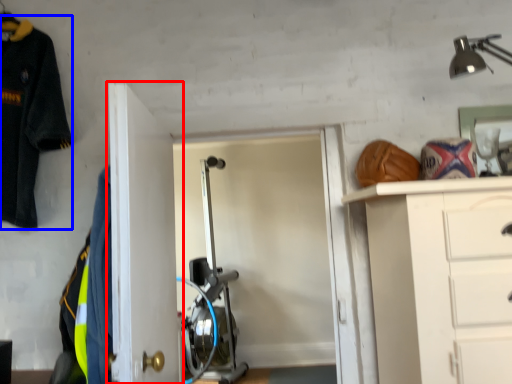
Question: Among these objects, which one is farthest to the camera, door (highlighted by a red box) or uniform (highlighted by a blue box)?

Choices:
 (A) door
 (B) uniform

Answer: (B)